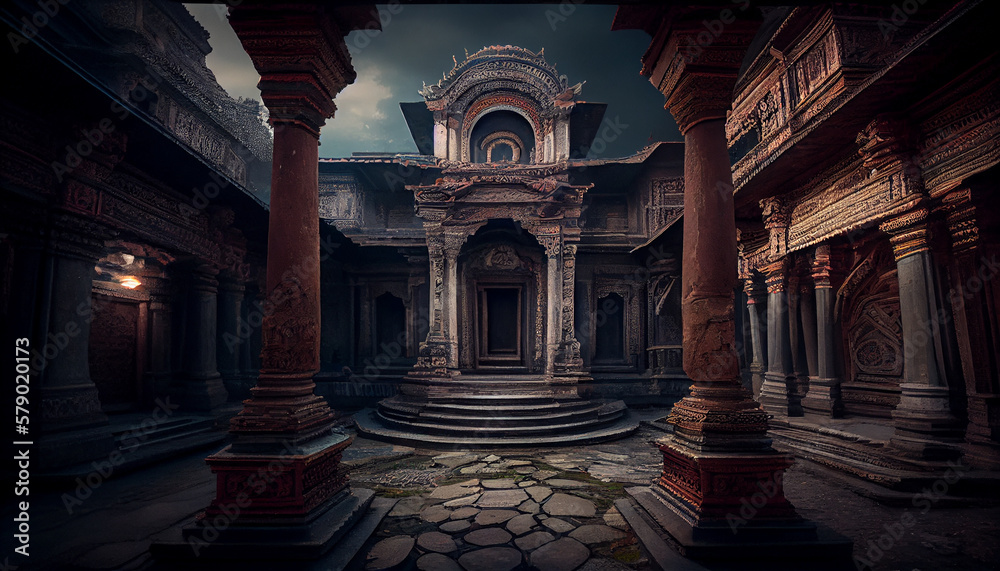
The height and width of the screenshot is (571, 1000). I want to click on door in center, so click(x=502, y=320).